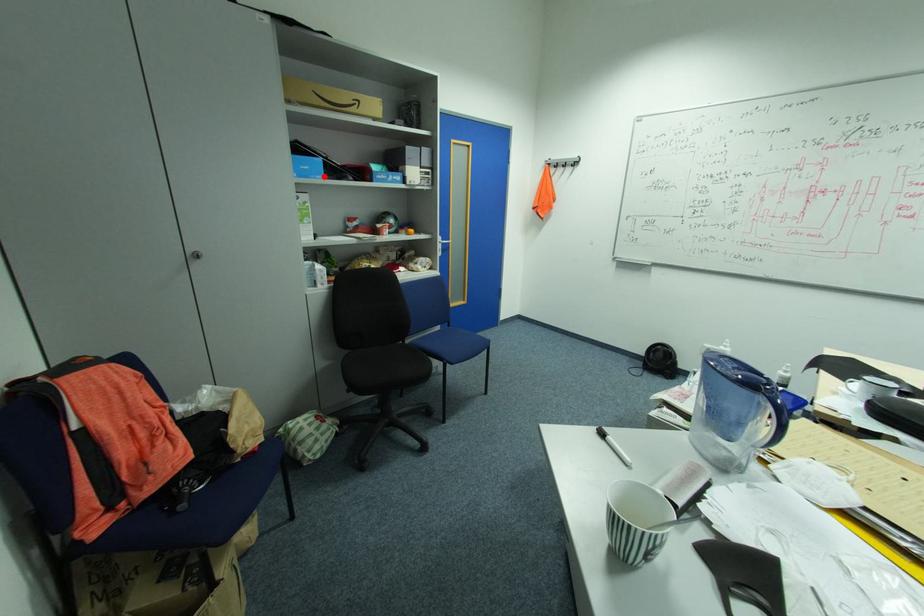
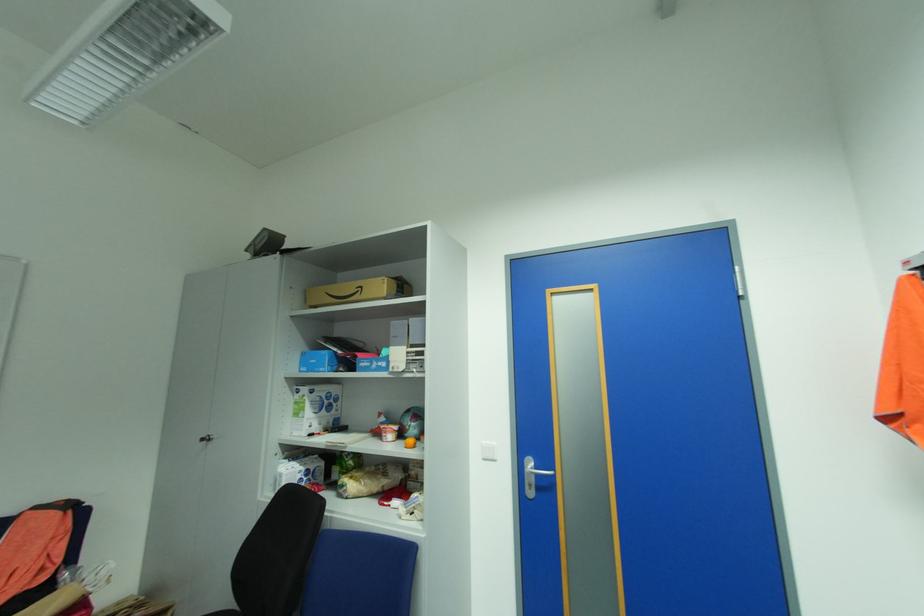
In the second image, find the point that corresponds to the highlighted location in the first image.

(327, 370)